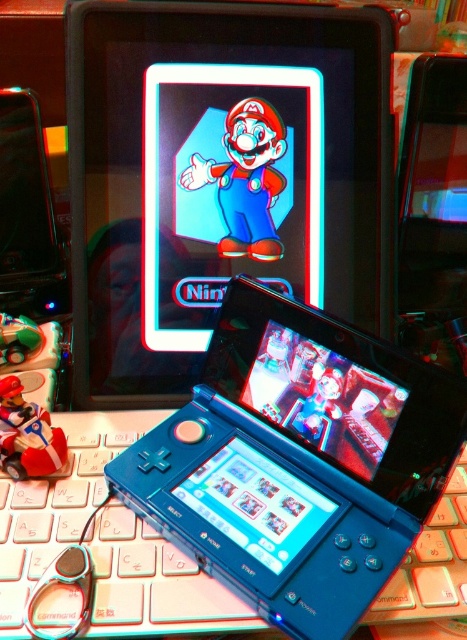
At what (x,y) coordinates should I click in order to perform the action: click on white plastic keyboard at center. Please return your answer as a coordinate pair (x, y). The height and width of the screenshot is (640, 467). Looking at the image, I should click on (154, 584).

Which is more to the left, blue plastic laptop at center or matte red figure at lower left?

matte red figure at lower left is more to the left.

Is point (247, 460) farther from viewer compared to point (9, 412)?

Yes, point (247, 460) is farther from viewer.

Between point (327, 378) and point (40, 448), which one is positioned in front?

Point (327, 378) is more forward.

The image size is (467, 640). What are the coordinates of `blue plastic laptop at center` in the screenshot? It's located at (297, 461).

The height and width of the screenshot is (640, 467). What do you see at coordinates (246, 179) in the screenshot? I see `matte blue nintendo ds at center` at bounding box center [246, 179].

Based on the photo, who is shorter, matte blue nintendo ds at center or matte red figure at lower left?

With less height is matte red figure at lower left.

Measure the distance between point (248,179) and camera.

A distance of 64.71 centimeters exists between point (248,179) and camera.

Find the location of a particular element. matte blue nintendo ds at center is located at coordinates (246, 179).